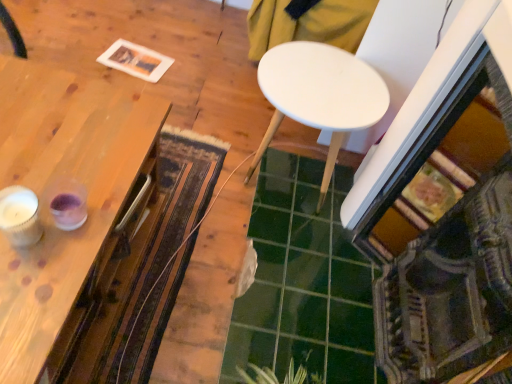
Question: Is textured woolen mat at center smaller than green glossy tile at center?

Choices:
 (A) no
 (B) yes

Answer: (B)

Question: Is green glossy tile at center at the back of textured woolen mat at center?

Choices:
 (A) no
 (B) yes

Answer: (B)

Question: Is textured woolen mat at center wider than green glossy tile at center?

Choices:
 (A) yes
 (B) no

Answer: (B)

Question: Is there a large distance between textured woolen mat at center and green glossy tile at center?

Choices:
 (A) no
 (B) yes

Answer: (A)

Question: Would you say green glossy tile at center is part of textured woolen mat at center's contents?

Choices:
 (A) yes
 (B) no

Answer: (B)

Question: Relative to white matte table at center, which appears as the 1th table when viewed from the right, is green leafy plant at lower center in front or behind?

Choices:
 (A) front
 (B) behind

Answer: (A)

Question: Is point (286, 375) positioned closer to the camera than point (357, 110)?

Choices:
 (A) closer
 (B) farther

Answer: (A)

Question: From their relative heights in the image, would you say green leafy plant at lower center is taller or shorter than white matte table at center, marked as the 2th table in a left-to-right arrangement?

Choices:
 (A) short
 (B) tall

Answer: (A)

Question: Visually, is green leafy plant at lower center positioned to the left or to the right of white matte table at center, which appears as the 1th table when viewed from the right?

Choices:
 (A) right
 (B) left

Answer: (B)

Question: Looking at the image, does green glossy tile at center seem bigger or smaller compared to textured woolen mat at center?

Choices:
 (A) small
 (B) big

Answer: (B)

Question: Considering the positions of green glossy tile at center and textured woolen mat at center in the image, is green glossy tile at center wider or thinner than textured woolen mat at center?

Choices:
 (A) wide
 (B) thin

Answer: (A)

Question: Considering their positions, is green glossy tile at center located in front of or behind textured woolen mat at center?

Choices:
 (A) behind
 (B) front

Answer: (A)

Question: Do you think green glossy tile at center is within textured woolen mat at center, or outside of it?

Choices:
 (A) outside
 (B) inside

Answer: (A)

Question: Is point (6, 230) closer or farther from the camera than point (272, 124)?

Choices:
 (A) closer
 (B) farther

Answer: (A)

Question: Based on their sizes in the image, would you say white textured candle at left is bigger or smaller than white matte table at center, marked as the 2th table in a left-to-right arrangement?

Choices:
 (A) big
 (B) small

Answer: (B)